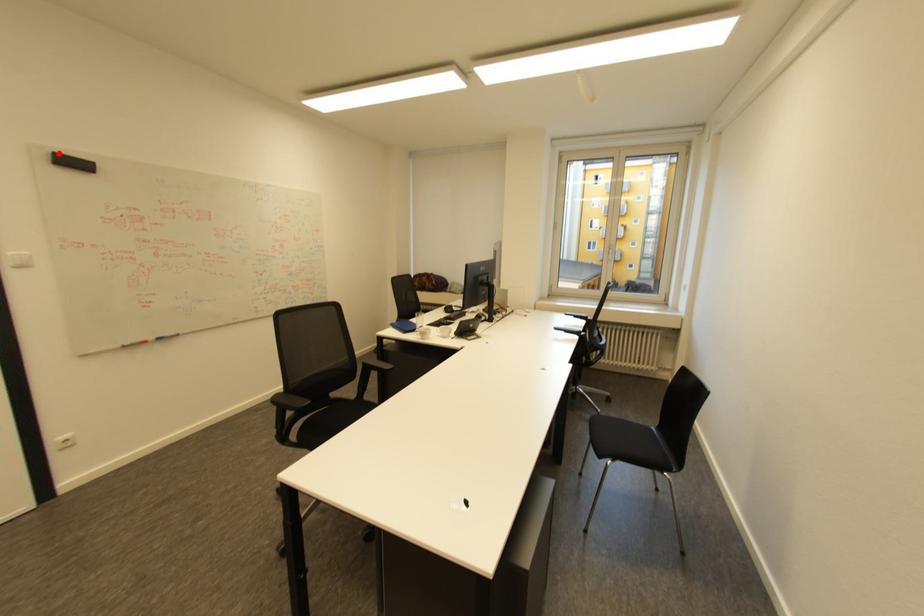
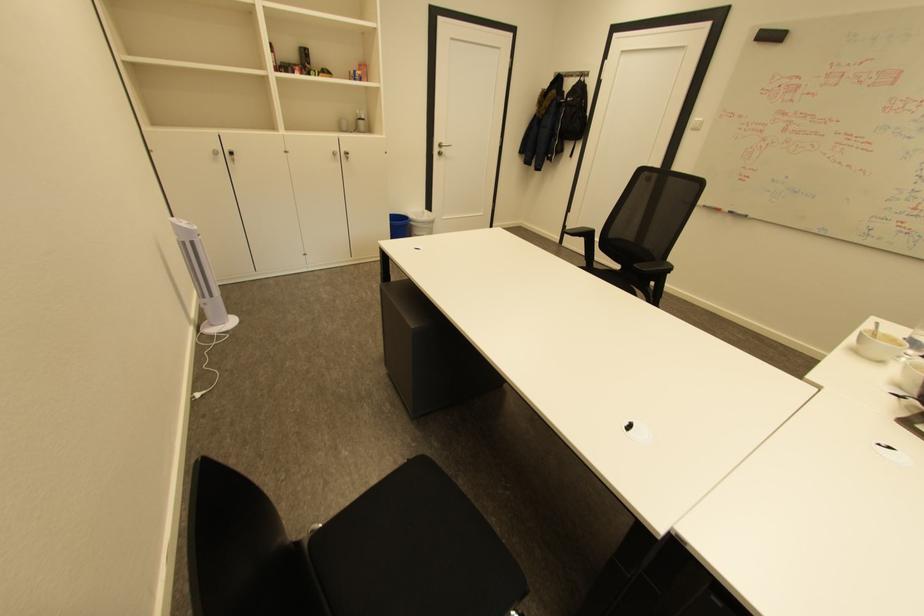
In the second image, find the point that corresponds to the highlighted location in the first image.

(768, 30)